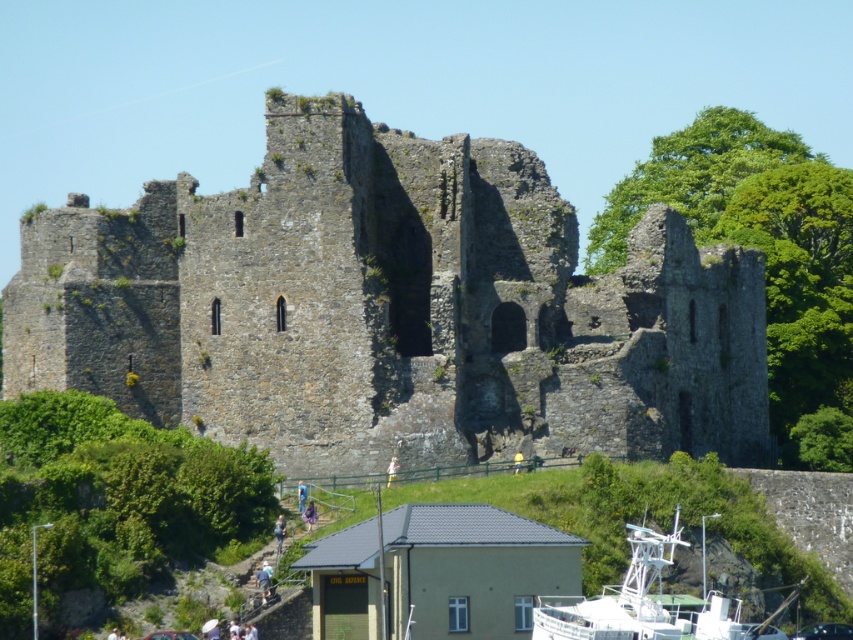
Is rusty stone castle at center positioned behind white plastic boat at lower center?

That is True.

This screenshot has height=640, width=853. What do you see at coordinates (390, 308) in the screenshot? I see `rusty stone castle at center` at bounding box center [390, 308].

Is point (463, 189) closer to viewer compared to point (743, 636)?

No, it is behind (743, 636).

In order to click on rusty stone castle at center in this screenshot , I will do `click(390, 308)`.